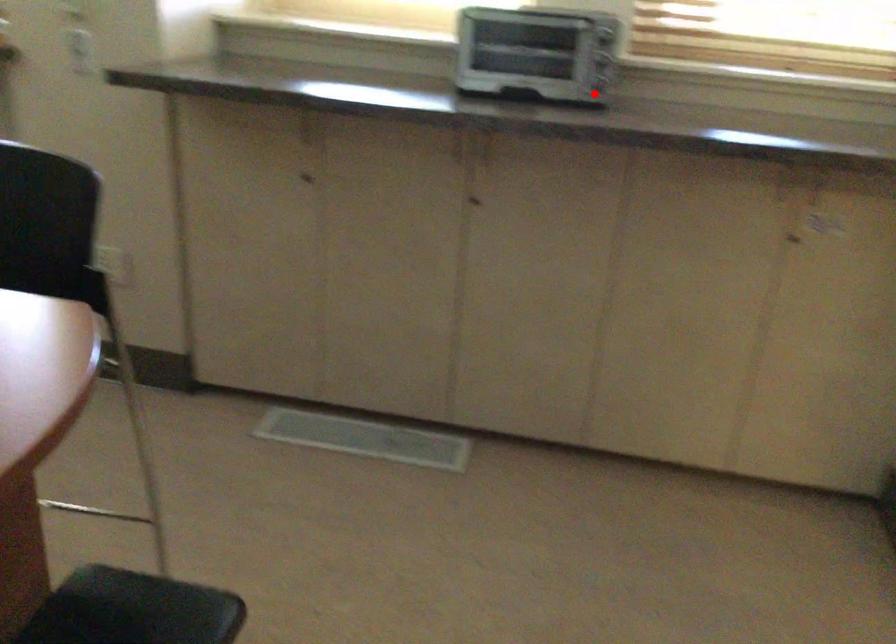
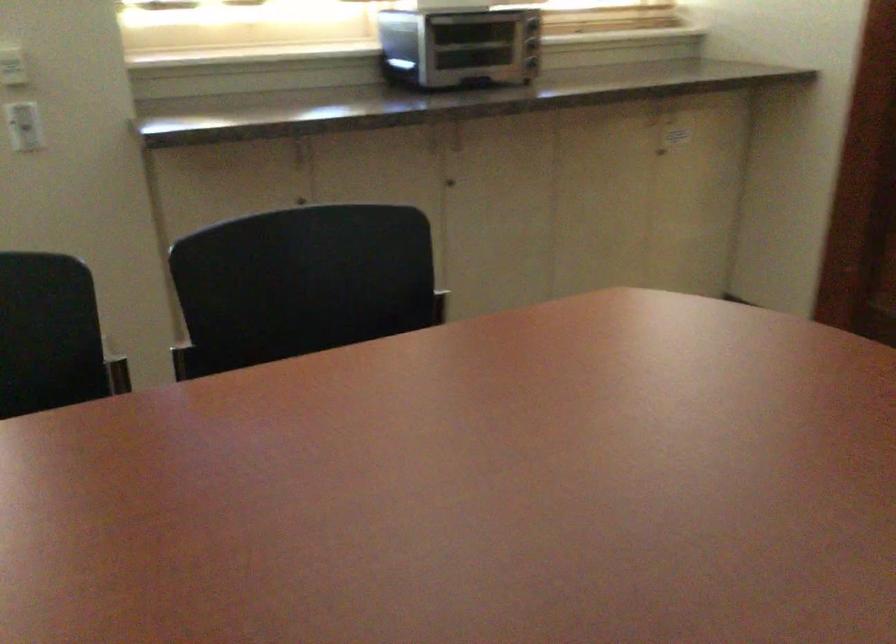
The point at the highlighted location is marked in the first image. Where is the corresponding point in the second image?

(531, 62)